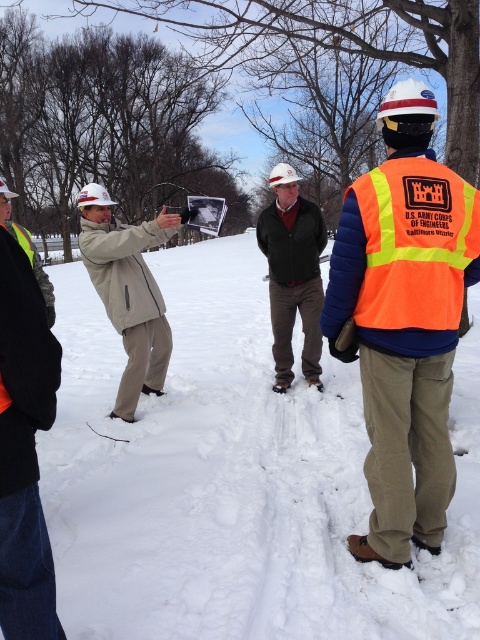
Does white powdery snow at center have a greater height compared to orange reflective vest at center?

Correct, white powdery snow at center is much taller as orange reflective vest at center.

Between point (67, 582) and point (367, 388), which one is positioned in front?

Positioned in front is point (67, 582).

Locate an element on the screen. This screenshot has width=480, height=640. white powdery snow at center is located at coordinates (235, 477).

Is beige fabric jacket at center to the right of green matte jacket at center from the viewer's perspective?

In fact, beige fabric jacket at center is to the left of green matte jacket at center.

Which is behind, point (109, 246) or point (279, 186)?

Positioned behind is point (279, 186).

At what (x,y) coordinates should I click in order to perform the action: click on beige fabric jacket at center. Please return your answer as a coordinate pair (x, y). Looking at the image, I should click on (128, 291).

Can you confirm if orange reflective vest at center is bigger than green matte jacket at center?

No, orange reflective vest at center is not bigger than green matte jacket at center.

Is orange reflective vest at center thinner than green matte jacket at center?

No, orange reflective vest at center is not thinner than green matte jacket at center.

Between point (393, 556) and point (287, 246), which one is positioned behind?

Positioned behind is point (287, 246).

This screenshot has width=480, height=640. What are the coordinates of `orange reflective vest at center` in the screenshot? It's located at (405, 321).